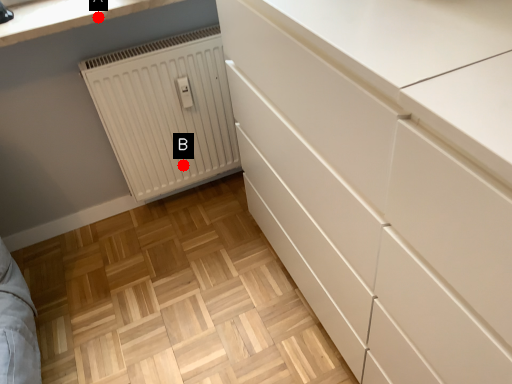
Question: Two points are circled on the image, labeled by A and B beside each circle. Which point is closer to the camera taking this photo?

Choices:
 (A) A is closer
 (B) B is closer

Answer: (A)